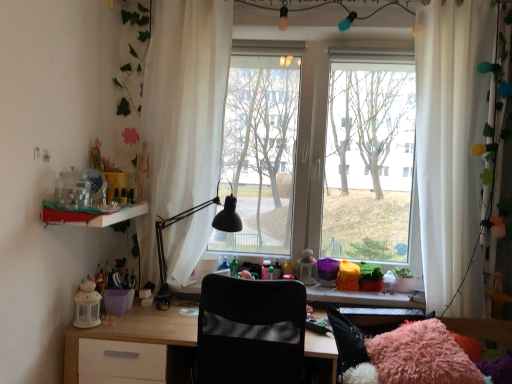
Question: Is point (232, 223) positioned closer to the camera than point (188, 77)?

Choices:
 (A) farther
 (B) closer

Answer: (B)

Question: Is black matte desk lamp at center wider or thinner than white sheer curtain at center, acting as the second curtain starting from the right?

Choices:
 (A) wide
 (B) thin

Answer: (A)

Question: Based on their relative distances, which object is farther from the matte plastic shelf at left?

Choices:
 (A) white sheer curtain at right, the 1th curtain from the right
 (B) light wood desk at center
 (C) black mesh chair at center
 (D) white sheer curtain at center, acting as the second curtain starting from the right
 (E) transparent glass window at center

Answer: (A)

Question: Which is nearer to the matte plastic shelf at left?

Choices:
 (A) black matte desk lamp at center
 (B) white sheer curtain at center, acting as the second curtain starting from the right
 (C) white sheer curtain at right, the 1th curtain from the right
 (D) transparent glass window at center
 (E) black mesh chair at center

Answer: (A)